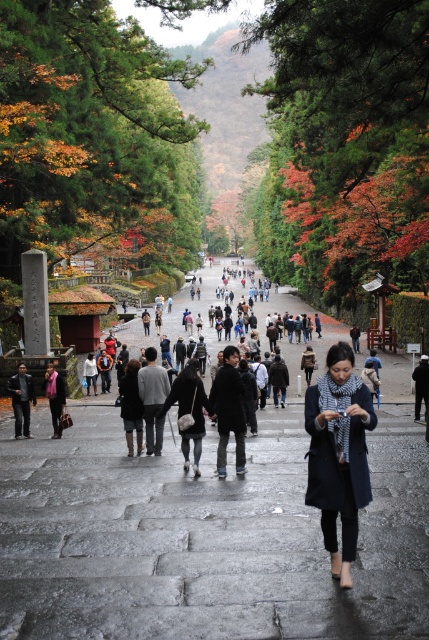
You are standing at the point marked as point (138, 448) and want to walk to the point marked as point (302, 364). Which direction should you move in to get there?

You should move downward and to the left to reach point (302, 364) from point (138, 448).

You are standing at the starting point of the pathway and see the point marked as point (132, 406). What object is located at that point?

The dark gray wool coat at center is located at point (132, 406).

You are a photographer trying to capture both the gray wool sweater at center and the dark gray leather jacket at left in a single frame. Since you can only focus on one object at a time, which one should you focus on to ensure the other remains in the background?

You should focus on the gray wool sweater at center because it is in front of the dark gray leather jacket at left, so the jacket will naturally appear in the background.